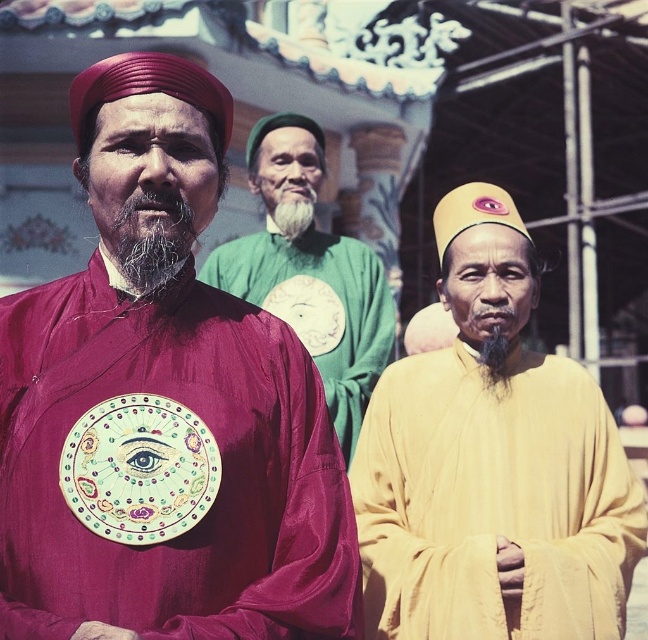
You are a photographer trying to capture the central figure in this scene. You notice the green matte robe at center and the black silky beard at center. Which object is positioned closer to you, the photographer?

The green matte robe at center is closer to the viewer than the black silky beard at center, so the green matte robe at center is positioned closer to you.

You are a photographer taking a picture of the scene. You need to ensure that the green matte robe at center and the black silky beard at center are both visible in the frame. Based on their sizes, which one might require you to adjust your camera angle to capture fully?

The green matte robe at center is much taller than the black silky beard at center, so you might need to adjust the camera angle to ensure the entire height of the green matte robe at center is captured in the frame.